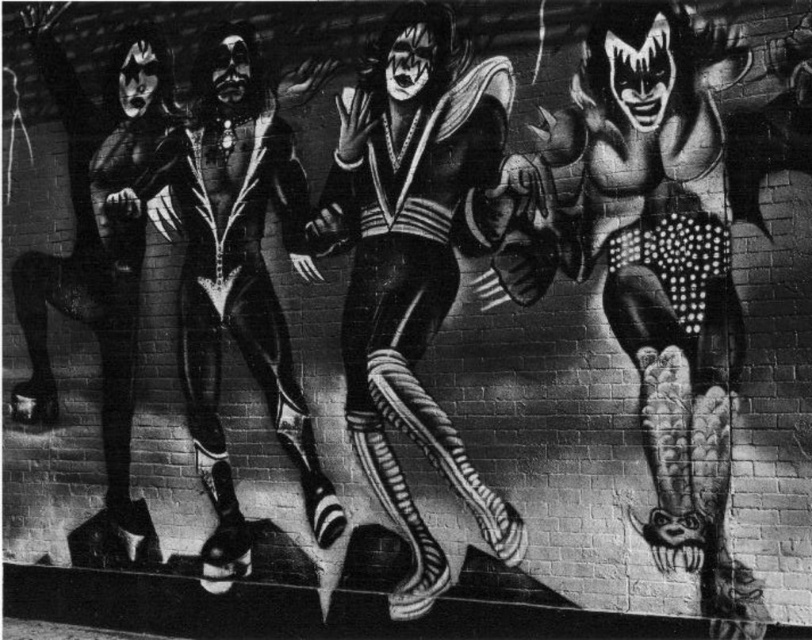
Based on the photo, you are standing 2 meters away from the point at point (692, 248). If you walk straight towards it, how far will you have to walk to reach the point?

You are currently 2 meters away from the point at point (692, 248). To reach it, you will need to walk 2 meters straight towards it.

Looking at the black and white mural on the brick wall, you see four figures dressed in various costumes. There is a point at coordinates (413, 262). Which costume is located at that point?

The point at coordinates (413, 262) indicates the black leather suit at center.